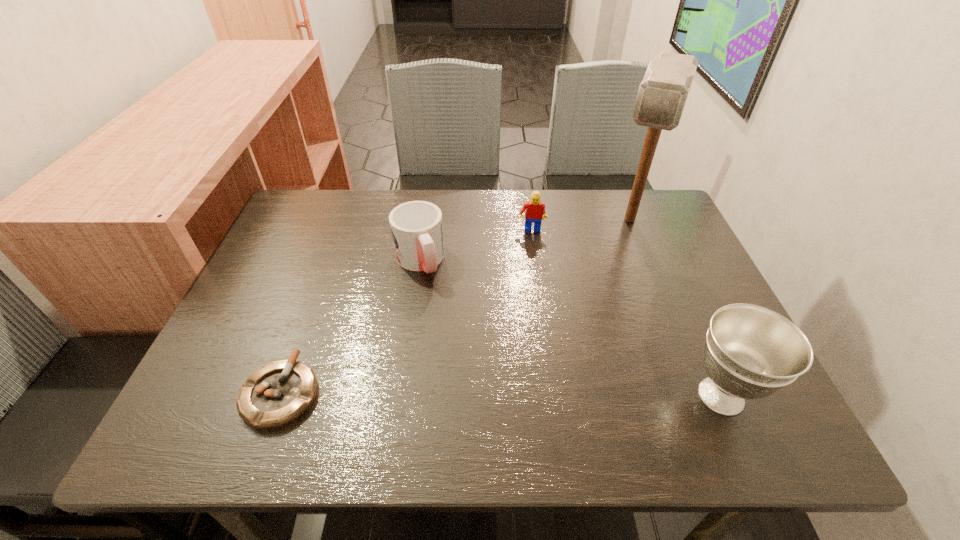
Locate an element on the screen. The image size is (960, 540). free space on the desktop that is between the leftmost object and the fourth shortest object and is positioned on the front-facing side of the third object from left to right is located at coordinates (526, 395).

Image resolution: width=960 pixels, height=540 pixels. In order to click on vacant space on the desktop that is between the ashtray and the fourth shortest object and is positioned on the side of the fourth object from right to left with the handle in this screenshot , I will do `click(480, 394)`.

The height and width of the screenshot is (540, 960). I want to click on vacant space on the desktop that is between the leftmost object and the second tallest object and is positioned above the head of the mallet, so click(564, 395).